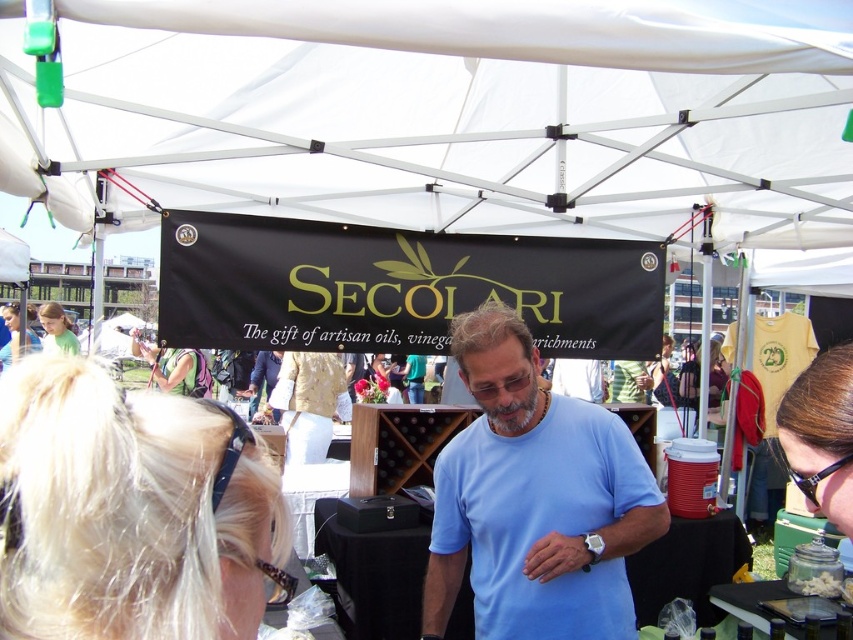
Question: Does sunglasses at upper right lie behind green fabric backpack at lower left?

Choices:
 (A) no
 (B) yes

Answer: (A)

Question: Considering the real-world distances, which object is closest to the matte black hair at center?

Choices:
 (A) green fabric backpack at lower left
 (B) sunglasses at upper right
 (C) blue cotton shirt at center
 (D) matte black shirt at center

Answer: (A)

Question: Where is white fabric canopy at upper center located in relation to sunglasses at upper right in the image?

Choices:
 (A) below
 (B) above

Answer: (B)

Question: Which point is closer to the camera taking this photo?

Choices:
 (A) (386, 385)
 (B) (509, 230)
 (C) (819, 358)
 (D) (473, 480)

Answer: (C)

Question: Which of the following is the farthest from the observer?

Choices:
 (A) (215, 628)
 (B) (134, 336)
 (C) (560, 589)
 (D) (846, 472)

Answer: (B)

Question: Is blue cotton shirt at center further to the viewer compared to sunglasses at upper right?

Choices:
 (A) yes
 (B) no

Answer: (A)